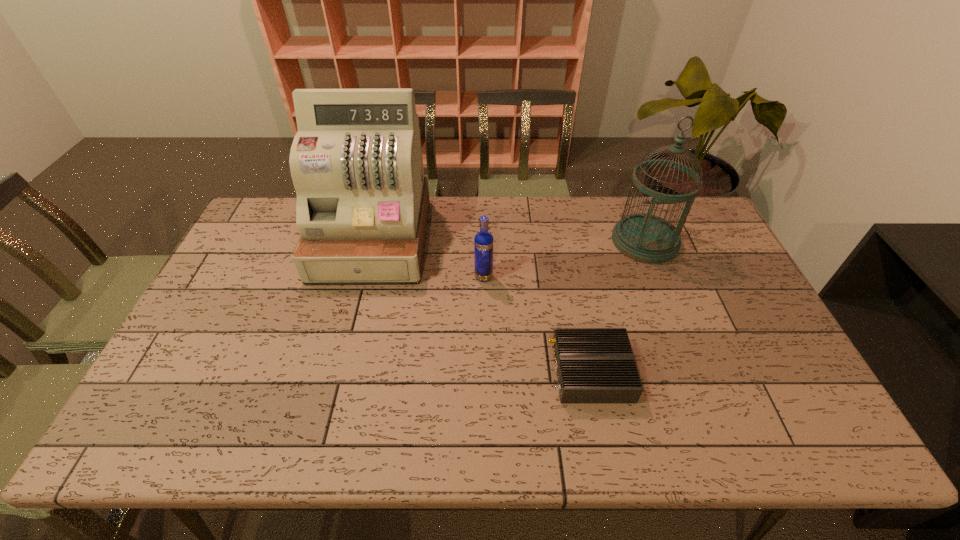
In the image, there is a desktop. Find the location of `vacant area at the far right corner`. vacant area at the far right corner is located at coordinates (695, 233).

Locate an element on the screen. This screenshot has width=960, height=540. vacant point located between the nearest object and the leftmost object is located at coordinates (482, 306).

Identify the location of vacant region between the vodka and the router. The image size is (960, 540). click(x=538, y=324).

The image size is (960, 540). Identify the location of empty space between the cash register and the second object from right to left. (482, 306).

Locate an element on the screen. Image resolution: width=960 pixels, height=540 pixels. empty space between the third object from left to right and the vodka is located at coordinates (538, 324).

This screenshot has width=960, height=540. Find the location of `vacant area that lies between the rightmost object and the cash register`. vacant area that lies between the rightmost object and the cash register is located at coordinates (509, 240).

What are the coordinates of `free spot between the birdcage and the third tallest object` in the screenshot? It's located at (564, 259).

Where is `vacant area between the vodka and the router`? Image resolution: width=960 pixels, height=540 pixels. vacant area between the vodka and the router is located at coordinates (538, 324).

The width and height of the screenshot is (960, 540). In order to click on vacant area between the rightmost object and the cash register in this screenshot , I will do `click(509, 240)`.

Locate an element on the screen. vacant area that lies between the second object from left to right and the third object from left to right is located at coordinates (538, 324).